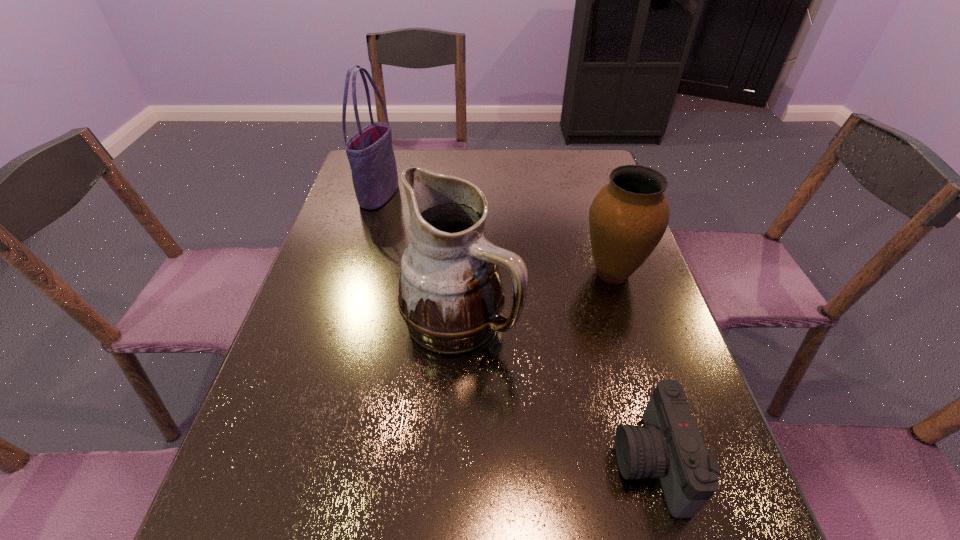
Select which object appears as the third closest to the second shortest object. Please provide its 2D coordinates. Your answer should be formatted as a tuple, i.e. [(x, y)], where the tuple contains the x and y coordinates of a point satisfying the conditions above.

[(370, 152)]

Where is `object that stands as the third closest to the farthest object`? The height and width of the screenshot is (540, 960). object that stands as the third closest to the farthest object is located at coordinates (669, 446).

Identify the location of free space that satisfies the following two spatial constraints: 1. on the front side of the urn; 2. on the left side of the tote bag. Image resolution: width=960 pixels, height=540 pixels. (356, 273).